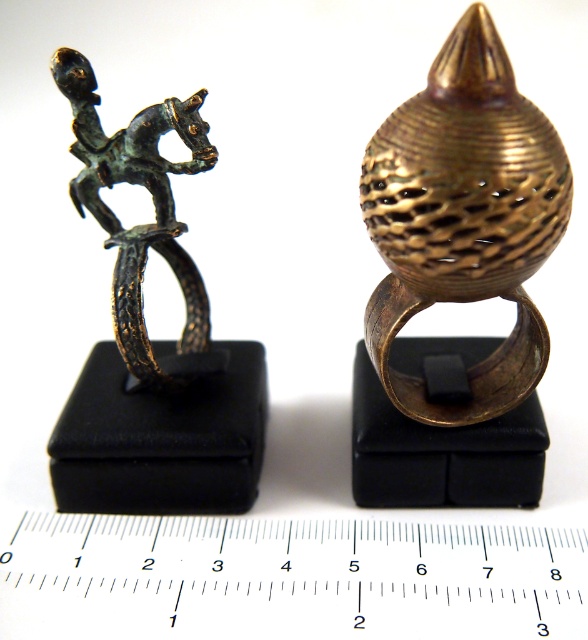
You are an appraiser examining two items displayed in the image. You need to determine which item has a greater width. The items are the gold textured ring at center and the bronze figure at left. Which one is wider?

The gold textured ring at center is wider than the bronze figure at left.

You are an archaeologist examining the artifacts displayed on the black stands. You need to measure the distance between the small figurine on the left and the metallic ruler at center. Which object should you use the ruler on to get an accurate measurement?

The metallic ruler at center should be used to measure the distance between the small figurine on the left and itself, but since the ruler is a tool for measurement, you would use it to measure the distance from the small figurine on the left to another object or point. However, based on the provided information, the ruler is at the center, so you would use it to measure from the small figurine on the left to the ruler itself.